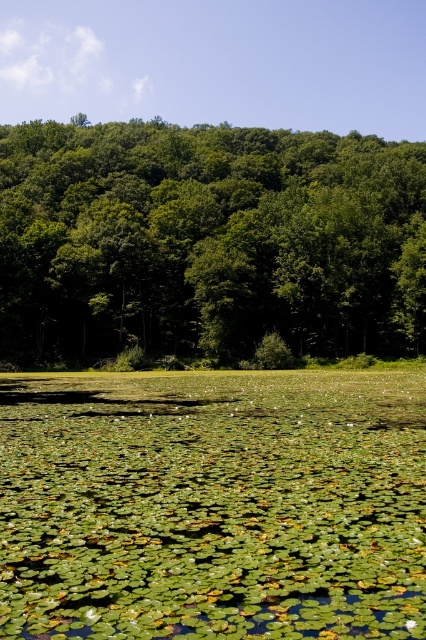
Question: Where is green leafy water at center located in relation to green leafy trees at upper center in the image?

Choices:
 (A) right
 (B) left

Answer: (A)

Question: Which of the following is the farthest from the observer?

Choices:
 (A) (317, 561)
 (B) (340, 308)

Answer: (B)

Question: Which of the following is the closest to the observer?

Choices:
 (A) (235, 209)
 (B) (219, 524)

Answer: (B)

Question: Is green leafy water at center bigger than green leafy trees at upper center?

Choices:
 (A) no
 (B) yes

Answer: (A)

Question: Can you confirm if green leafy water at center is thinner than green leafy trees at upper center?

Choices:
 (A) no
 (B) yes

Answer: (B)